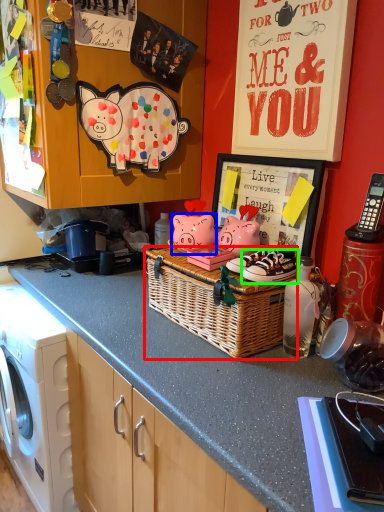
Question: Estimate the real-world distances between objects in this image. Which object is farther from picnic basket (highlighted by a red box), pig (highlighted by a blue box) or footwear (highlighted by a green box)?

Choices:
 (A) pig
 (B) footwear

Answer: (A)